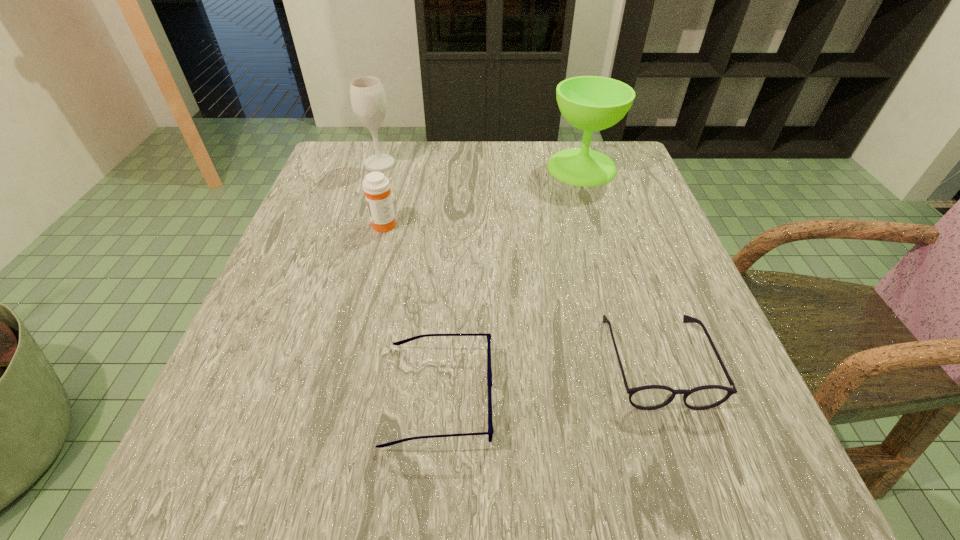
Where is `object at the near edge`? object at the near edge is located at coordinates (490, 432).

Identify the location of wineglass positioned at the left edge. (367, 95).

This screenshot has height=540, width=960. I want to click on medicine situated at the left edge, so click(x=376, y=186).

You are a GUI agent. You are given a task and a screenshot of the screen. Output one action in this format:
    pyautogui.click(x=<x>, y=<y>)
    Task: Click on the wineglass positioned at the right edge
    
    Given the screenshot: What is the action you would take?
    pyautogui.click(x=591, y=103)

This screenshot has height=540, width=960. I want to click on spectacles located at the right edge, so click(649, 397).

Image resolution: width=960 pixels, height=540 pixels. Identify the location of object located in the far left corner section of the desktop. (367, 95).

Identify the location of object positioned at the far right corner. (591, 103).

Identify the location of vacant space at the far edge. Image resolution: width=960 pixels, height=540 pixels. (485, 159).

In the image, there is a desktop. Identify the location of vacant space at the left edge. The height and width of the screenshot is (540, 960). (346, 200).

Where is `blank space at the right edge of the desktop`? The height and width of the screenshot is (540, 960). blank space at the right edge of the desktop is located at coordinates pos(660,421).